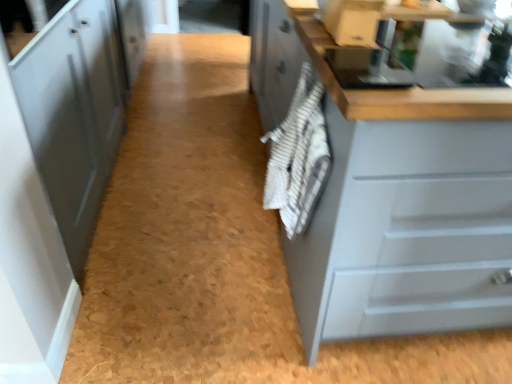
Question: Does matte gray cabinet at right, which ranks as the second cabinetry in left-to-right order, have a greater height compared to matte gray cabinet at left, which is the 2th cabinetry in right-to-left order?

Choices:
 (A) no
 (B) yes

Answer: (A)

Question: Is matte gray cabinet at right, positioned as the first cabinetry in right-to-left order, closer to camera compared to matte gray cabinet at left, which is the 2th cabinetry in right-to-left order?

Choices:
 (A) no
 (B) yes

Answer: (B)

Question: Is matte gray cabinet at right, positioned as the first cabinetry in right-to-left order, at the left side of matte gray cabinet at left, which is the 2th cabinetry in right-to-left order?

Choices:
 (A) yes
 (B) no

Answer: (B)

Question: Would you say matte gray cabinet at right, which ranks as the second cabinetry in left-to-right order, is outside matte gray cabinet at left, marked as the 1th cabinetry in a left-to-right arrangement?

Choices:
 (A) yes
 (B) no

Answer: (A)

Question: Is matte gray cabinet at right, which ranks as the second cabinetry in left-to-right order, far away from matte gray cabinet at left, which is the 2th cabinetry in right-to-left order?

Choices:
 (A) no
 (B) yes

Answer: (A)

Question: Does matte gray cabinet at right, positioned as the first cabinetry in right-to-left order, have a larger size compared to matte gray cabinet at left, marked as the 1th cabinetry in a left-to-right arrangement?

Choices:
 (A) yes
 (B) no

Answer: (B)

Question: Is matte gray cabinet at left, marked as the 1th cabinetry in a left-to-right arrangement, located within white striped towel at center?

Choices:
 (A) yes
 (B) no

Answer: (B)

Question: From a real-world perspective, is white striped towel at center physically below matte gray cabinet at left, marked as the 1th cabinetry in a left-to-right arrangement?

Choices:
 (A) yes
 (B) no

Answer: (B)

Question: Does white striped towel at center come behind matte gray cabinet at left, marked as the 1th cabinetry in a left-to-right arrangement?

Choices:
 (A) yes
 (B) no

Answer: (A)

Question: Can you confirm if white striped towel at center is positioned to the left of matte gray cabinet at left, which is the 2th cabinetry in right-to-left order?

Choices:
 (A) no
 (B) yes

Answer: (A)

Question: Is white striped towel at center beside matte gray cabinet at left, marked as the 1th cabinetry in a left-to-right arrangement?

Choices:
 (A) yes
 (B) no

Answer: (B)

Question: Considering the relative sizes of white striped towel at center and matte gray cabinet at left, which is the 2th cabinetry in right-to-left order, in the image provided, is white striped towel at center wider than matte gray cabinet at left, which is the 2th cabinetry in right-to-left order,?

Choices:
 (A) no
 (B) yes

Answer: (A)

Question: From the image's perspective, does matte gray cabinet at left, marked as the 1th cabinetry in a left-to-right arrangement, appear higher than matte gray cabinet at right, which ranks as the second cabinetry in left-to-right order?

Choices:
 (A) yes
 (B) no

Answer: (A)